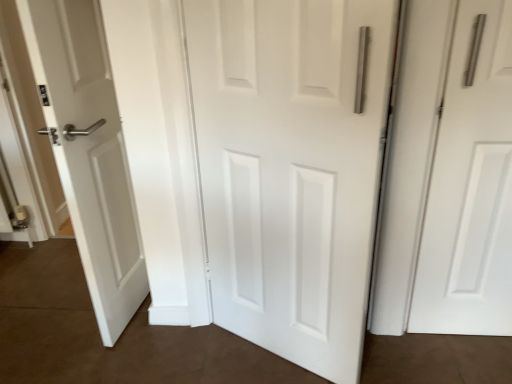
What do you see at coordinates (470, 185) in the screenshot?
I see `white matte door at right, arranged as the 2th door when viewed from the left` at bounding box center [470, 185].

Where is `white matte door at right, arranged as the 2th door when viewed from the left`? The width and height of the screenshot is (512, 384). white matte door at right, arranged as the 2th door when viewed from the left is located at coordinates (470, 185).

Looking at this image, measure the distance between white matte door at right, arranged as the 2th door when viewed from the left, and camera.

They are 3.75 feet apart.

What is the approximate width of white matte door at center, the 2th door when ordered from right to left?

1.62 inches.

Where is `white matte door at center, the 2th door when ordered from right to left`? This screenshot has height=384, width=512. white matte door at center, the 2th door when ordered from right to left is located at coordinates (291, 168).

This screenshot has height=384, width=512. What do you see at coordinates (291, 168) in the screenshot?
I see `white matte door at center, the 2th door when ordered from right to left` at bounding box center [291, 168].

I want to click on white matte door at right, which ranks as the first door in right-to-left order, so click(x=470, y=185).

Considering the relative positions of white matte door at right, arranged as the 2th door when viewed from the left, and white matte door at center, the 1th door in the left-to-right sequence, in the image provided, is white matte door at right, arranged as the 2th door when viewed from the left, to the right of white matte door at center, the 1th door in the left-to-right sequence, from the viewer's perspective?

Indeed, white matte door at right, arranged as the 2th door when viewed from the left, is positioned on the right side of white matte door at center, the 1th door in the left-to-right sequence.

Is white matte door at right, arranged as the 2th door when viewed from the left, positioned in front of white matte door at center, the 1th door in the left-to-right sequence?

No, it is not.

Considering the points (467, 159) and (291, 271), which point is behind, point (467, 159) or point (291, 271)?

Positioned behind is point (291, 271).

From the image's perspective, which one is positioned lower, white matte door at right, arranged as the 2th door when viewed from the left, or white matte door at center, the 1th door in the left-to-right sequence?

white matte door at center, the 1th door in the left-to-right sequence, appears lower in the image.

From a real-world perspective, is white matte door at right, arranged as the 2th door when viewed from the left, on top of white matte door at center, the 2th door when ordered from right to left?

No, from a real-world perspective, white matte door at right, arranged as the 2th door when viewed from the left, is not above white matte door at center, the 2th door when ordered from right to left.

Considering the sizes of objects white matte door at right, which ranks as the first door in right-to-left order, and white matte door at center, the 2th door when ordered from right to left, in the image provided, who is thinner, white matte door at right, which ranks as the first door in right-to-left order, or white matte door at center, the 2th door when ordered from right to left,?

white matte door at center, the 2th door when ordered from right to left, is thinner.

Considering the relative sizes of white matte door at right, which ranks as the first door in right-to-left order, and white matte door at center, the 2th door when ordered from right to left, in the image provided, is white matte door at right, which ranks as the first door in right-to-left order, shorter than white matte door at center, the 2th door when ordered from right to left,?

Correct, white matte door at right, which ranks as the first door in right-to-left order, is not as tall as white matte door at center, the 2th door when ordered from right to left.

Consider the image. Who is bigger, white matte door at right, which ranks as the first door in right-to-left order, or white matte door at center, the 2th door when ordered from right to left?

white matte door at center, the 2th door when ordered from right to left, is bigger.

Is white matte door at right, which ranks as the first door in right-to-left order, not within white matte door at center, the 2th door when ordered from right to left?

white matte door at right, which ranks as the first door in right-to-left order, is positioned outside white matte door at center, the 2th door when ordered from right to left.

Are white matte door at right, arranged as the 2th door when viewed from the left, and white matte door at center, the 1th door in the left-to-right sequence, making contact?

No, white matte door at right, arranged as the 2th door when viewed from the left, is not making contact with white matte door at center, the 1th door in the left-to-right sequence.

Is white matte door at right, arranged as the 2th door when viewed from the left, facing towards white matte door at center, the 1th door in the left-to-right sequence?

No, white matte door at right, arranged as the 2th door when viewed from the left, is not turned towards white matte door at center, the 1th door in the left-to-right sequence.

Looking at this image, can you tell me how much white matte door at right, which ranks as the first door in right-to-left order, and white matte door at center, the 2th door when ordered from right to left, differ in facing direction?

The angle between the facing direction of white matte door at right, which ranks as the first door in right-to-left order, and the facing direction of white matte door at center, the 2th door when ordered from right to left, is 31.8 degrees.

Measure the distance from white matte door at right, which ranks as the first door in right-to-left order, to white matte door at center, the 2th door when ordered from right to left.

The distance of white matte door at right, which ranks as the first door in right-to-left order, from white matte door at center, the 2th door when ordered from right to left, is 20.09 inches.

In the image, there is a white matte door at center, the 2th door when ordered from right to left. At what (x,y) coordinates should I click in order to perform the action: click on door above it (from the image's perspective). Please return your answer as a coordinate pair (x, y). This screenshot has width=512, height=384. Looking at the image, I should click on (470, 185).

Visually, is white matte door at center, the 1th door in the left-to-right sequence, positioned to the left or to the right of white matte door at right, which ranks as the first door in right-to-left order?

Clearly, white matte door at center, the 1th door in the left-to-right sequence, is on the left of white matte door at right, which ranks as the first door in right-to-left order, in the image.

Does white matte door at center, the 2th door when ordered from right to left, lie behind white matte door at right, which ranks as the first door in right-to-left order?

No, white matte door at center, the 2th door when ordered from right to left, is closer to the viewer.

Which point is more forward, (x=337, y=316) or (x=446, y=253)?

The point (x=337, y=316) is closer.

From the image's perspective, is white matte door at center, the 1th door in the left-to-right sequence, on top of white matte door at right, which ranks as the first door in right-to-left order?

Incorrect, from the image's perspective, white matte door at center, the 1th door in the left-to-right sequence, is lower than white matte door at right, which ranks as the first door in right-to-left order.

From a real-world perspective, is white matte door at center, the 1th door in the left-to-right sequence, above or below white matte door at right, which ranks as the first door in right-to-left order?

white matte door at center, the 1th door in the left-to-right sequence, is situated higher than white matte door at right, which ranks as the first door in right-to-left order, in the real world.

In the scene shown: Does white matte door at center, the 1th door in the left-to-right sequence, have a lesser width compared to white matte door at right, arranged as the 2th door when viewed from the left?

Yes, white matte door at center, the 1th door in the left-to-right sequence, is thinner than white matte door at right, arranged as the 2th door when viewed from the left.

Consider the image. Considering the sizes of objects white matte door at center, the 2th door when ordered from right to left, and white matte door at right, arranged as the 2th door when viewed from the left, in the image provided, who is shorter, white matte door at center, the 2th door when ordered from right to left, or white matte door at right, arranged as the 2th door when viewed from the left,?

white matte door at right, arranged as the 2th door when viewed from the left, is shorter.

Looking at the image, does white matte door at center, the 2th door when ordered from right to left, seem bigger or smaller compared to white matte door at right, which ranks as the first door in right-to-left order?

Considering their sizes, white matte door at center, the 2th door when ordered from right to left, takes up more space than white matte door at right, which ranks as the first door in right-to-left order.

Is white matte door at center, the 1th door in the left-to-right sequence, spatially inside white matte door at right, which ranks as the first door in right-to-left order, or outside of it?

white matte door at center, the 1th door in the left-to-right sequence, lies outside white matte door at right, which ranks as the first door in right-to-left order.

Is white matte door at center, the 1th door in the left-to-right sequence, not near white matte door at right, which ranks as the first door in right-to-left order?

No, white matte door at center, the 1th door in the left-to-right sequence, is not far from white matte door at right, which ranks as the first door in right-to-left order.

Is white matte door at right, arranged as the 2th door when viewed from the left, at the back of white matte door at center, the 1th door in the left-to-right sequence?

That's not correct — white matte door at center, the 1th door in the left-to-right sequence, is not looking away from white matte door at right, arranged as the 2th door when viewed from the left.

This screenshot has width=512, height=384. Find the location of `door on the left of the white matte door at right, which ranks as the first door in right-to-left order`. door on the left of the white matte door at right, which ranks as the first door in right-to-left order is located at coordinates (291, 168).

I want to click on door on the left of white matte door at right, which ranks as the first door in right-to-left order, so click(x=291, y=168).

Find the location of a particular element. The image size is (512, 384). door located in front of the white matte door at right, arranged as the 2th door when viewed from the left is located at coordinates (291, 168).